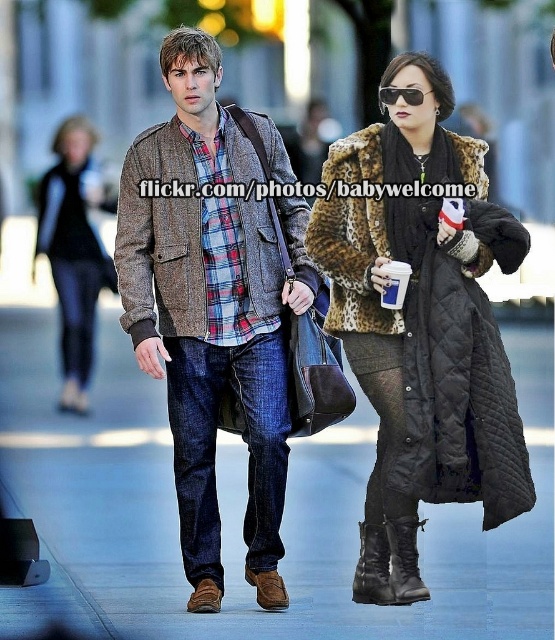
Can you confirm if fur coat at center is positioned to the left of black reflective sunglasses at upper center?

No, fur coat at center is not to the left of black reflective sunglasses at upper center.

Between point (465, 374) and point (390, 92), which one is positioned behind?

Positioned behind is point (390, 92).

Locate an element on the screen. The height and width of the screenshot is (640, 555). fur coat at center is located at coordinates (425, 308).

Measure the distance between dark blue denim jeans at center and black reflective sunglasses at upper center.

dark blue denim jeans at center is 7.35 meters from black reflective sunglasses at upper center.

Is point (274, 525) less distant than point (431, 90)?

No, (274, 525) is further to viewer.

This screenshot has width=555, height=640. In order to click on dark blue denim jeans at center in this screenshot , I will do click(x=214, y=445).

In the scene shown: Can you confirm if dark blue denim jeans at center is bigger than black leather boot at lower center?

Yes.

Can you confirm if dark blue denim jeans at center is positioned below black leather boot at lower center?

Incorrect, dark blue denim jeans at center is not positioned below black leather boot at lower center.

Which is behind, point (269, 396) or point (381, 596)?

Positioned behind is point (269, 396).

Identify the location of dark blue denim jeans at center. point(214,445).